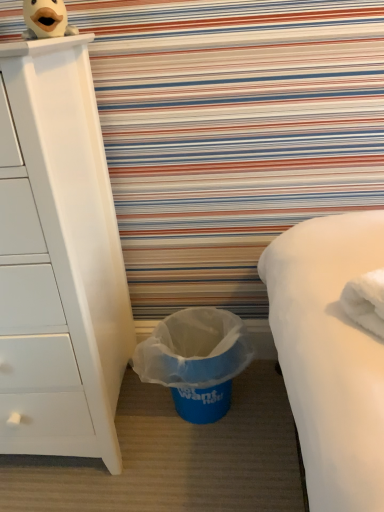
The width and height of the screenshot is (384, 512). Find the location of `plush duck at upper left`. plush duck at upper left is located at coordinates (46, 19).

What is the approximate height of blue plastic trash can at lower center?

blue plastic trash can at lower center is 10.64 inches tall.

Locate an element on the screen. The width and height of the screenshot is (384, 512). plush duck at upper left is located at coordinates (46, 19).

Is blue plastic trash can at lower center situated inside plush duck at upper left or outside?

blue plastic trash can at lower center lies outside plush duck at upper left.

Is point (227, 362) positioned after point (46, 0)?

Yes.

Does blue plastic trash can at lower center appear on the left side of plush duck at upper left?

Incorrect, blue plastic trash can at lower center is not on the left side of plush duck at upper left.

In terms of width, does blue plastic trash can at lower center look wider or thinner when compared to plush duck at upper left?

Considering their sizes, blue plastic trash can at lower center looks broader than plush duck at upper left.

Based on their sizes in the image, would you say plush duck at upper left is bigger or smaller than blue plastic trash can at lower center?

Clearly, plush duck at upper left is smaller in size than blue plastic trash can at lower center.

Considering their positions, is plush duck at upper left located in front of or behind blue plastic trash can at lower center?

plush duck at upper left is positioned closer to the viewer than blue plastic trash can at lower center.

From a real-world perspective, is plush duck at upper left physically above blue plastic trash can at lower center?

Indeed, from a real-world perspective, plush duck at upper left stands above blue plastic trash can at lower center.

In order to click on toy lying above the blue plastic trash can at lower center (from the image's perspective) in this screenshot , I will do `click(46, 19)`.

How many degrees apart are the facing directions of blue plastic trash can at lower center and white matte chest of drawers at left?

blue plastic trash can at lower center and white matte chest of drawers at left are facing 5.75 degrees away from each other.

Considering their positions, is blue plastic trash can at lower center located in front of or behind white matte chest of drawers at left?

Clearly, blue plastic trash can at lower center is behind white matte chest of drawers at left.

Which is more to the left, blue plastic trash can at lower center or white matte chest of drawers at left?

From the viewer's perspective, white matte chest of drawers at left appears more on the left side.

From the image's perspective, which is below, white matte chest of drawers at left or blue plastic trash can at lower center?

blue plastic trash can at lower center appears lower in the image.

Is the position of white matte chest of drawers at left more distant than that of blue plastic trash can at lower center?

No, it is in front of blue plastic trash can at lower center.

From a real-world perspective, is plush duck at upper left positioned over white matte chest of drawers at left based on gravity?

Yes, from a real-world perspective, plush duck at upper left is above white matte chest of drawers at left.

Could you tell me if plush duck at upper left is facing white matte chest of drawers at left?

No, plush duck at upper left is not oriented towards white matte chest of drawers at left.

Identify the location of the chest of drawers in front of the plush duck at upper left. (58, 259).

Which is more to the right, plush duck at upper left or white matte chest of drawers at left?

From the viewer's perspective, plush duck at upper left appears more on the right side.

Looking at this image, from a real-world perspective, between white matte chest of drawers at left and plush duck at upper left, who is vertically higher?

From a 3D spatial view, plush duck at upper left is above.

Which of these two, white matte chest of drawers at left or plush duck at upper left, is bigger?

Bigger between the two is white matte chest of drawers at left.

Does white matte chest of drawers at left contain plush duck at upper left?

No, plush duck at upper left is not surrounded by white matte chest of drawers at left.

Is white matte chest of drawers at left not close to plush duck at upper left?

No, white matte chest of drawers at left is not far from plush duck at upper left.

Locate an element on the screen. The width and height of the screenshot is (384, 512). garbage to the right of plush duck at upper left is located at coordinates click(196, 360).

Where is `toy above the blue plastic trash can at lower center (from the image's perspective)`? This screenshot has width=384, height=512. toy above the blue plastic trash can at lower center (from the image's perspective) is located at coordinates (46, 19).

Looking at this image, estimate the real-world distances between objects in this image. Which object is closer to white matte chest of drawers at left, blue plastic trash can at lower center or plush duck at upper left?

blue plastic trash can at lower center is closer to white matte chest of drawers at left.

Which object lies further to the anchor point plush duck at upper left, blue plastic trash can at lower center or white matte chest of drawers at left?

blue plastic trash can at lower center.

Which object lies further to the anchor point blue plastic trash can at lower center, white matte chest of drawers at left or plush duck at upper left?

The object further to blue plastic trash can at lower center is plush duck at upper left.

Which object lies further to the anchor point plush duck at upper left, white matte chest of drawers at left or blue plastic trash can at lower center?

blue plastic trash can at lower center.

Looking at the image, which one is located further to blue plastic trash can at lower center, plush duck at upper left or white matte chest of drawers at left?

The object further to blue plastic trash can at lower center is plush duck at upper left.

Which object lies nearer to the anchor point white matte chest of drawers at left, plush duck at upper left or blue plastic trash can at lower center?

blue plastic trash can at lower center.

At what (x,y) coordinates should I click in order to perform the action: click on chest of drawers between plush duck at upper left and blue plastic trash can at lower center in the up-down direction. Please return your answer as a coordinate pair (x, y). Looking at the image, I should click on (58, 259).